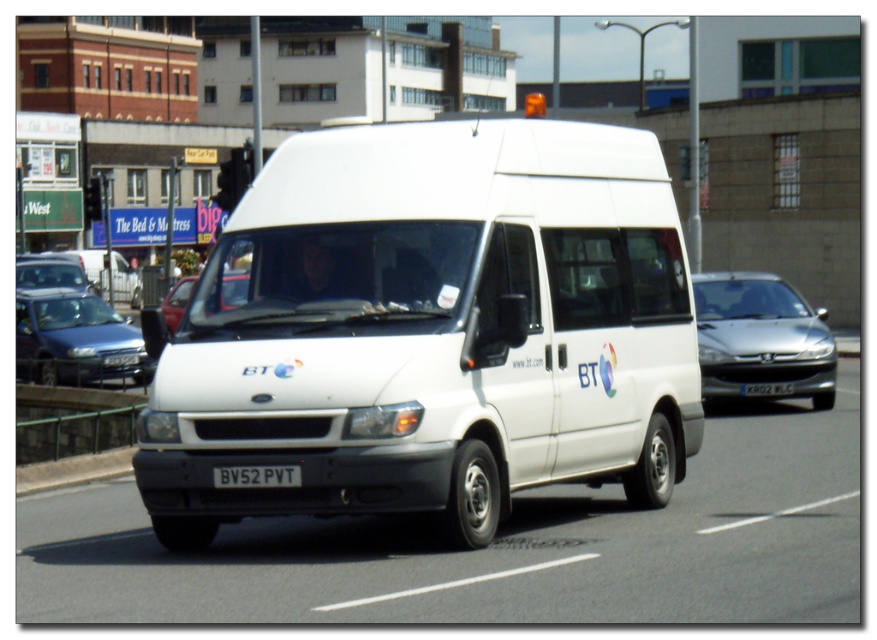
Is point (220, 288) closer to viewer compared to point (261, 467)?

No, (220, 288) is behind (261, 467).

Can you confirm if matte red car at center is positioned to the right of black plastic license plate at center?

Incorrect, matte red car at center is not on the right side of black plastic license plate at center.

Who is more distant from viewer, (225, 298) or (251, 472)?

The point (225, 298) is behind.

The image size is (877, 640). I want to click on matte red car at center, so click(177, 301).

Can you confirm if white matte van at center is positioned to the right of matte red car at center?

Correct, you'll find white matte van at center to the right of matte red car at center.

Between point (508, 512) and point (189, 292), which one is positioned in front?

Point (508, 512) is more forward.

Is point (448, 520) positioned after point (239, 282)?

No, it is not.

This screenshot has height=640, width=877. I want to click on white matte van at center, so click(430, 330).

Can you confirm if silver metallic sedan at right is taller than matte silver car at left?

No, silver metallic sedan at right is not taller than matte silver car at left.

Between silver metallic sedan at right and matte silver car at left, which one appears on the left side from the viewer's perspective?

From the viewer's perspective, matte silver car at left appears more on the left side.

Is point (753, 380) positioned in front of point (88, 289)?

Yes, it is.

Identify the location of silver metallic sedan at right. The image size is (877, 640). (761, 337).